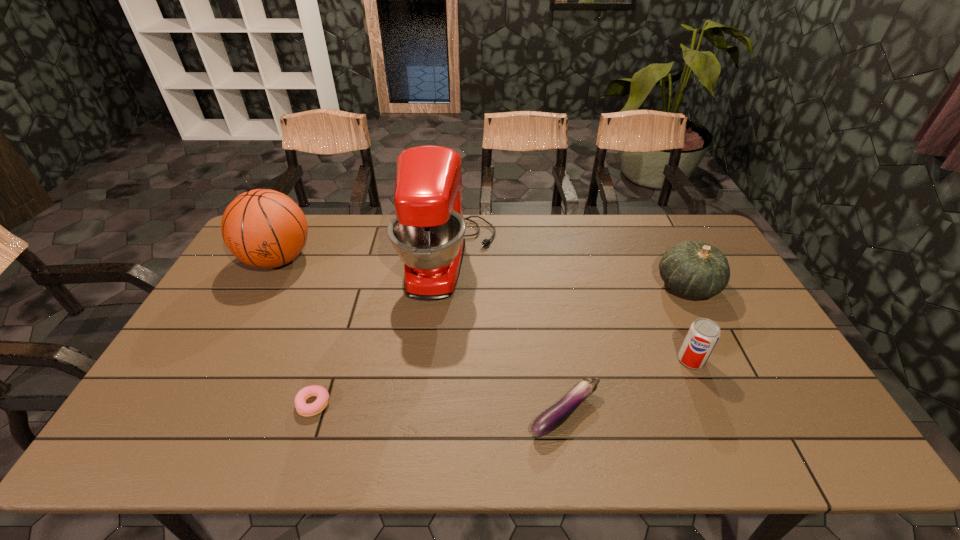
Where is `the tallest object`? Image resolution: width=960 pixels, height=540 pixels. the tallest object is located at coordinates (427, 232).

The height and width of the screenshot is (540, 960). I want to click on the third object from left to right, so click(x=427, y=232).

This screenshot has width=960, height=540. Find the location of `the leftmost object`. the leftmost object is located at coordinates (263, 228).

You are a GUI agent. You are given a task and a screenshot of the screen. Output one action in this format:
    pyautogui.click(x=<x>, y=<y>)
    Task: Click on the second tallest object
    
    Given the screenshot: What is the action you would take?
    pyautogui.click(x=263, y=228)

Identify the location of gourd. This screenshot has height=540, width=960. (694, 269).

Locate an element on the screen. the third nearest object is located at coordinates (703, 335).

I want to click on soda, so click(x=703, y=335).

Locate an element on the screen. the fifth tallest object is located at coordinates (556, 415).

The width and height of the screenshot is (960, 540). Identify the location of the fourth object from left to right. (556, 415).

Where is `doughnut`? This screenshot has width=960, height=540. doughnut is located at coordinates (303, 409).